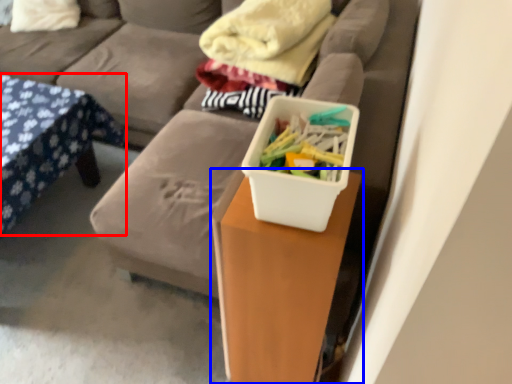
Question: Which object is closer to the camera taking this photo, furniture (highlighted by a red box) or table (highlighted by a blue box)?

Choices:
 (A) furniture
 (B) table

Answer: (B)